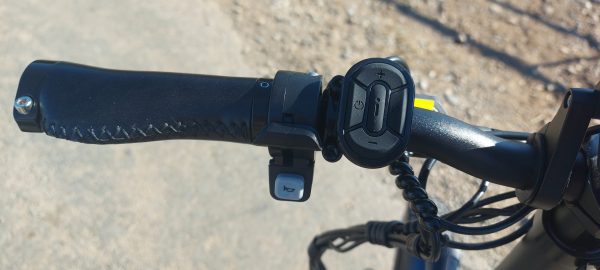
What are the coordinates of `handle` in the screenshot? It's located at (178, 98).